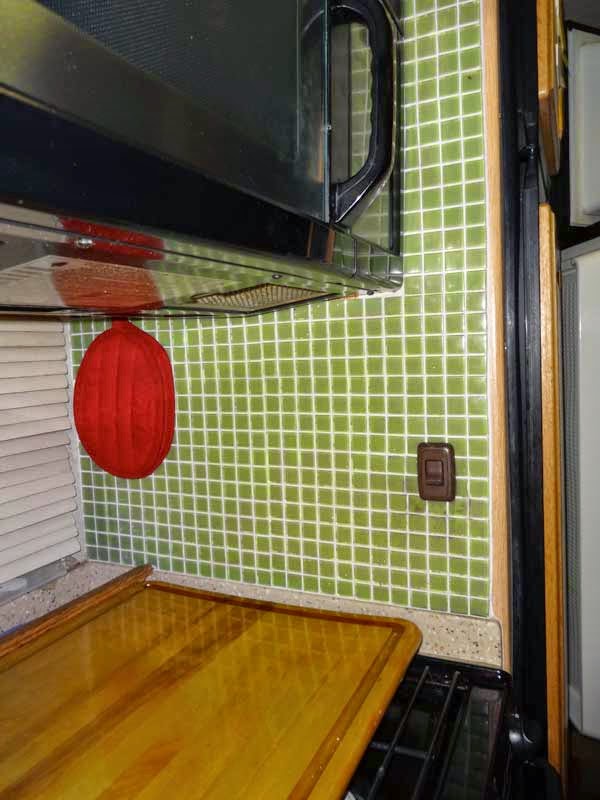
You are a GUI agent. You are given a task and a screenshot of the screen. Output one action in this format:
    pyautogui.click(x=<x>, y=<y>)
    Task: Click on the stove
    This screenshot has width=600, height=800.
    Given the screenshot: What is the action you would take?
    pyautogui.click(x=416, y=737)